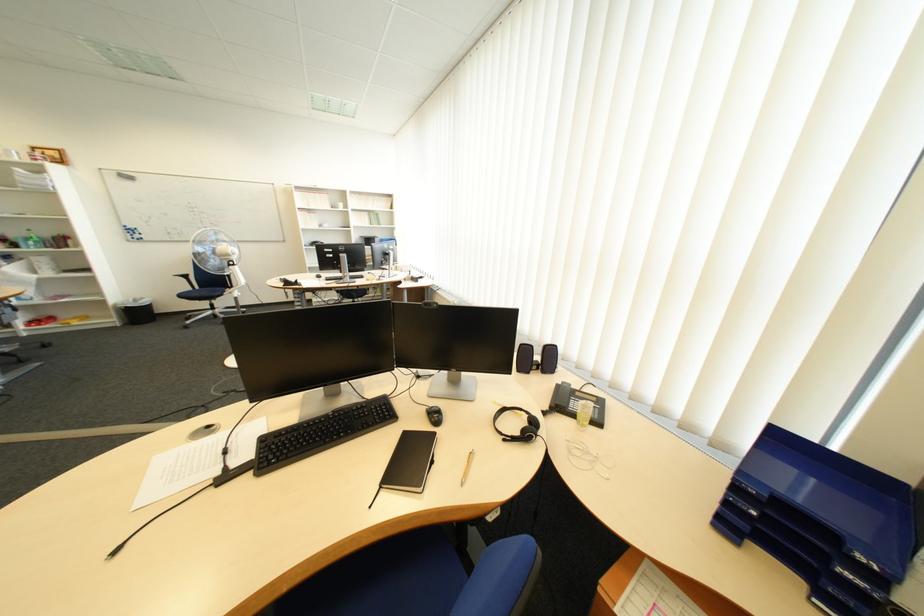
Which object does [803,371] point to?

This point indicates the pencil holder cup.